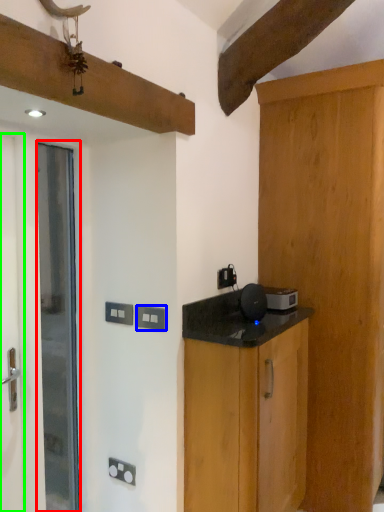
Question: Estimate the real-world distances between objects in this image. Which object is farther from door (highlighted by a red box), electric outlet (highlighted by a blue box) or screen door (highlighted by a green box)?

Choices:
 (A) electric outlet
 (B) screen door

Answer: (A)